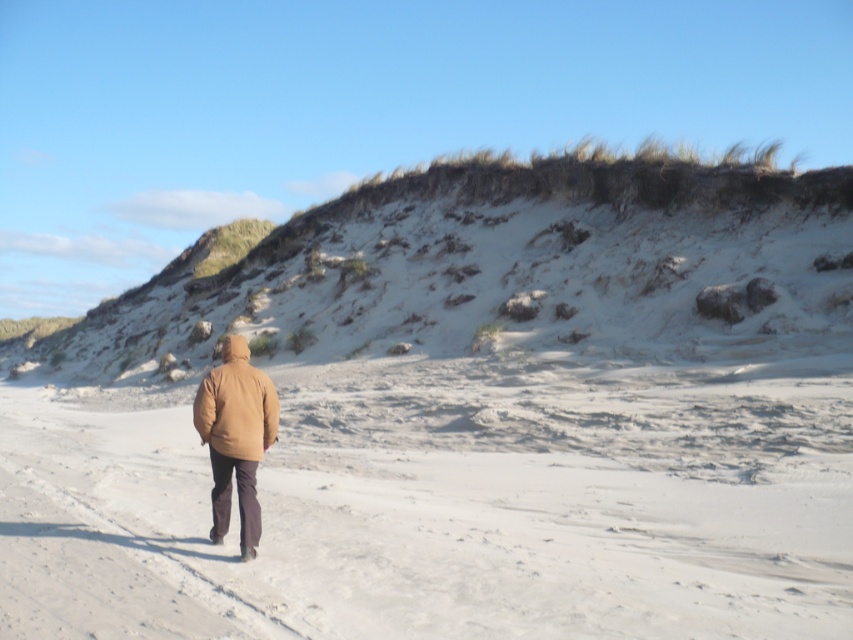
Does sandy/gravelly hillside at upper center have a smaller size compared to matte brown jacket at center?

No, sandy/gravelly hillside at upper center is not smaller than matte brown jacket at center.

Does sandy/gravelly hillside at upper center appear under matte brown jacket at center?

No.

Find the location of `sandy/gravelly hillside at upper center`. sandy/gravelly hillside at upper center is located at coordinates (495, 268).

This screenshot has width=853, height=640. In order to click on sandy/gravelly hillside at upper center in this screenshot , I will do [x=495, y=268].

Between point (293, 483) and point (235, 458), which one is positioned behind?

The point (293, 483) is more distant.

Find the location of a particular element. white sandy beach at center is located at coordinates pyautogui.click(x=405, y=538).

Between white sandy beach at center and sandy/gravelly hillside at upper center, which one is positioned lower?

white sandy beach at center

Between point (674, 547) and point (793, 182), which one is positioned behind?

The point (793, 182) is more distant.

Locate an element on the screen. The width and height of the screenshot is (853, 640). white sandy beach at center is located at coordinates (405, 538).